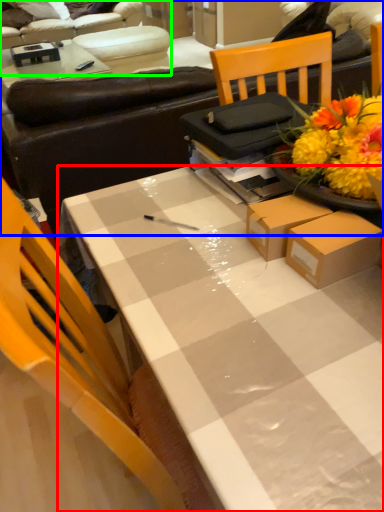
Question: Which object is positioned farthest from desk (highlighted by a red box)? Select from studio couch (highlighted by a blue box) and studio couch (highlighted by a green box).

Choices:
 (A) studio couch
 (B) studio couch

Answer: (B)